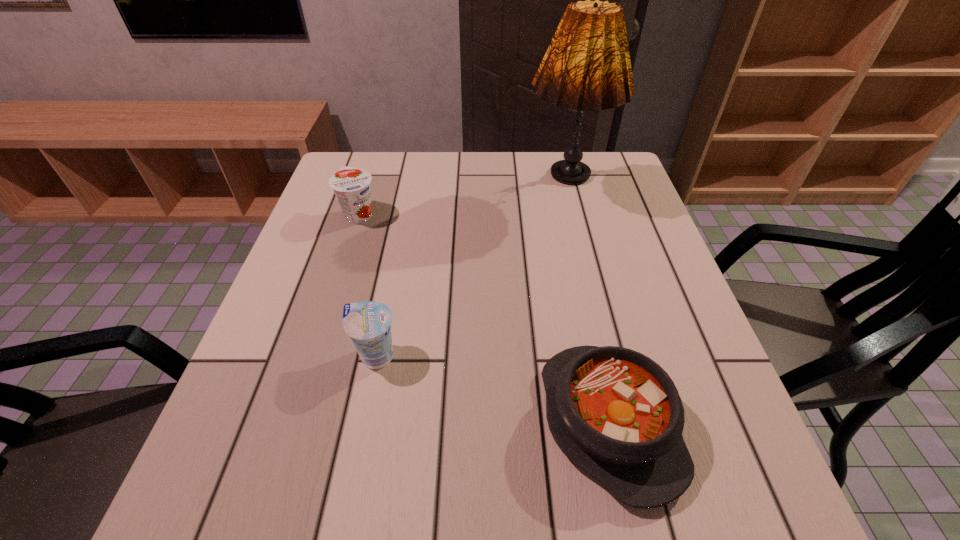
In order to click on object located in the far edge section of the desktop in this screenshot , I will do `click(587, 66)`.

This screenshot has width=960, height=540. I want to click on object present at the near edge, so click(615, 413).

Where is `object that is at the left edge`? The image size is (960, 540). object that is at the left edge is located at coordinates (351, 186).

This screenshot has height=540, width=960. Find the location of `lampshade that is at the right edge`. lampshade that is at the right edge is located at coordinates (587, 66).

You are a GUI agent. You are given a task and a screenshot of the screen. Output one action in this format:
    pyautogui.click(x=<x>, y=<y>)
    Task: Click on the casserole at the right edge
    The height and width of the screenshot is (540, 960).
    Given the screenshot: What is the action you would take?
    pyautogui.click(x=615, y=413)

At what (x,y) coordinates should I click in order to perform the action: click on object present at the far right corner. Please return your answer as a coordinate pair (x, y). The image size is (960, 540). Looking at the image, I should click on (587, 66).

Find the location of a particular element. The width and height of the screenshot is (960, 540). object located in the near right corner section of the desktop is located at coordinates (615, 413).

This screenshot has height=540, width=960. What are the coordinates of `vacant region at the far edge` in the screenshot? It's located at (550, 174).

Find the location of a particular element. The image size is (960, 540). blank area at the left edge is located at coordinates (309, 380).

At what (x,y) coordinates should I click in order to perform the action: click on free space at the right edge. Please return your answer as a coordinate pair (x, y). This screenshot has width=960, height=540. Looking at the image, I should click on (631, 217).